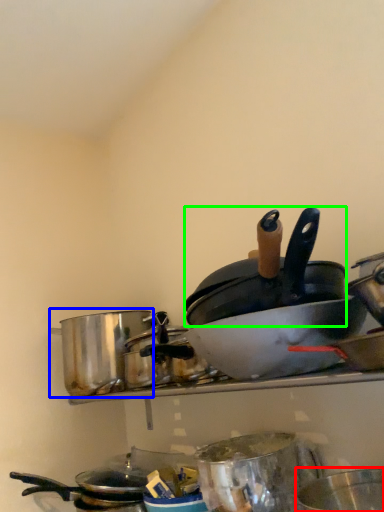
Question: Considering the real-world distances, which object is closest to basin (highlighted by a red box)? crock pot (highlighted by a blue box) or frying pan (highlighted by a green box).

Choices:
 (A) crock pot
 (B) frying pan

Answer: (B)